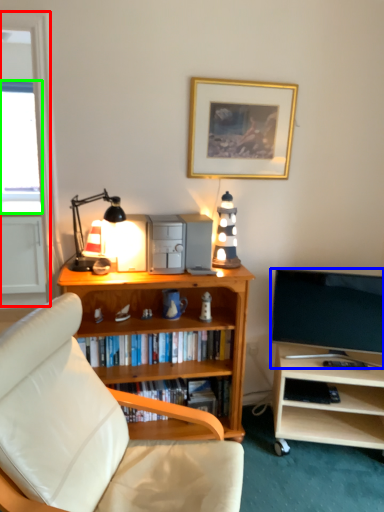
Question: Considering the real-world distances, which object is farthest from glass door (highlighted by a red box)? television (highlighted by a blue box) or window screen (highlighted by a green box)?

Choices:
 (A) television
 (B) window screen

Answer: (B)